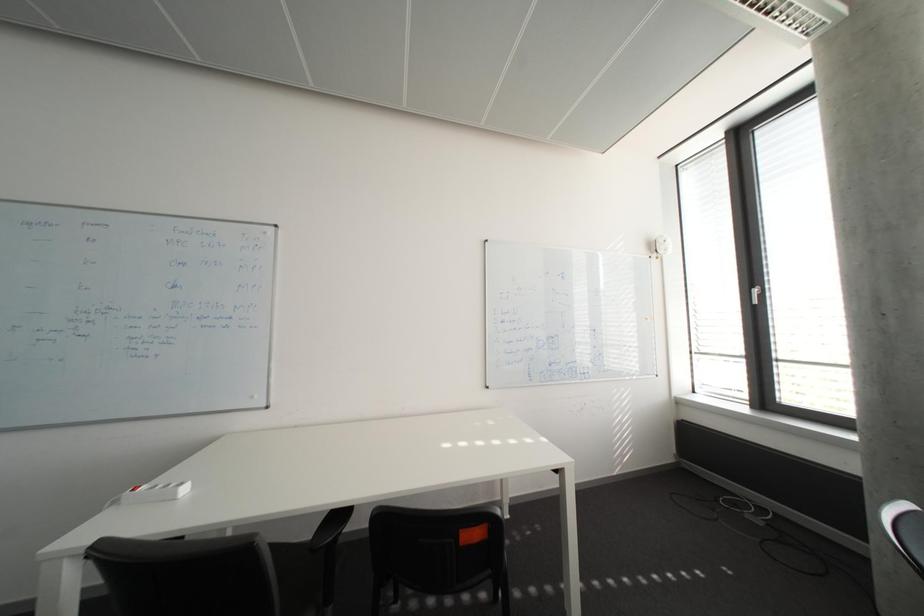
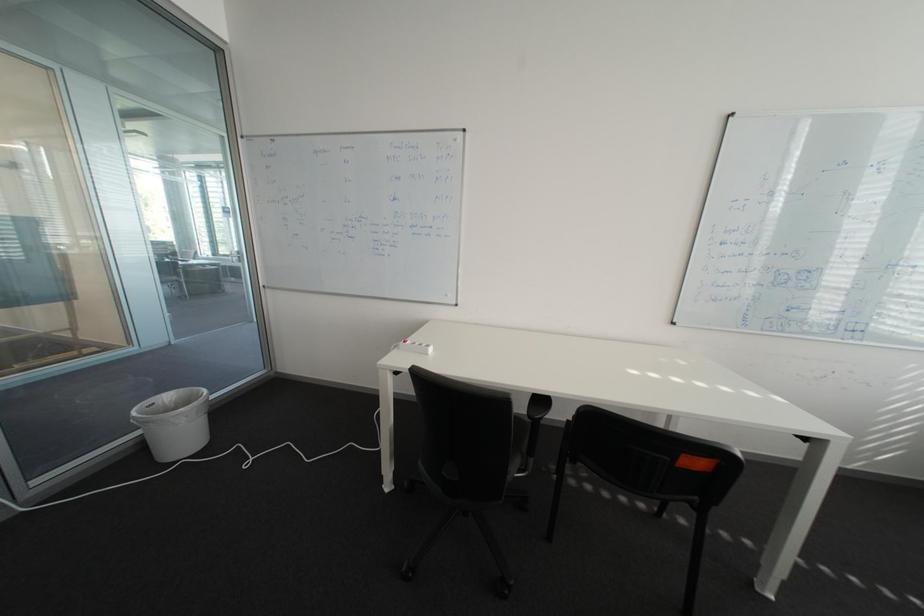
The first image is from the beginning of the video and the second image is from the end. How did the camera likely rotate when shooting the video?

The camera's rotation is toward left-down.